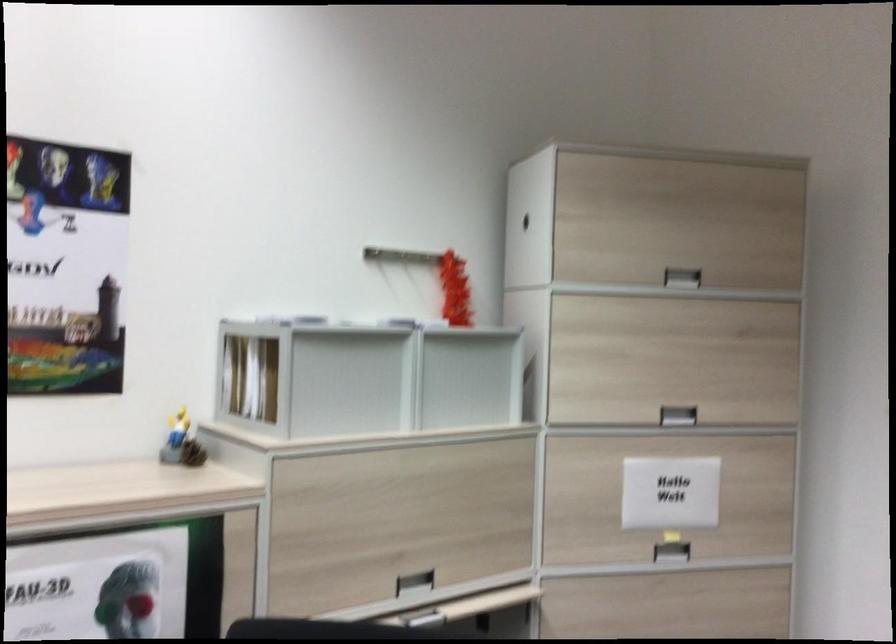
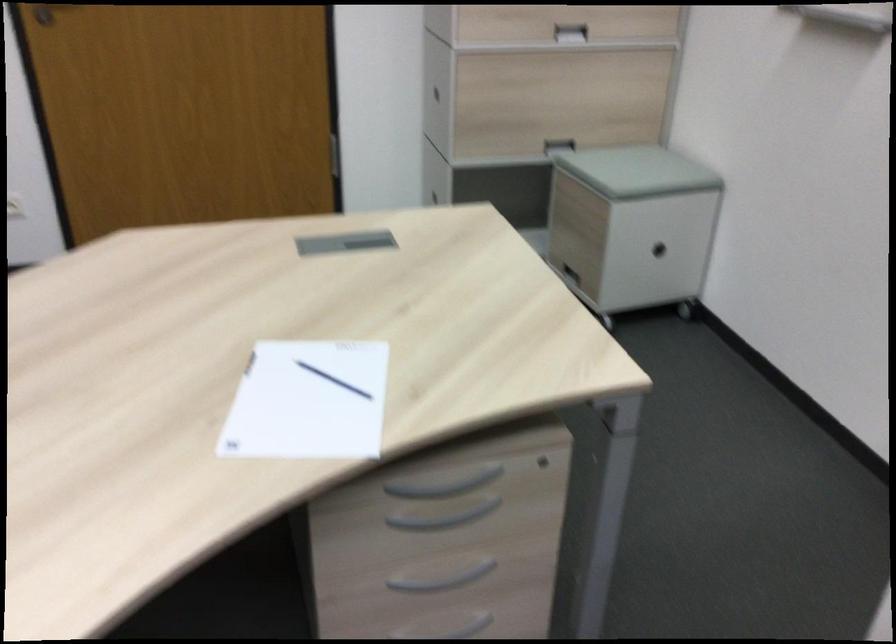
Based on the photo, how did the camera likely rotate?

The rotation direction of the camera is right-down.